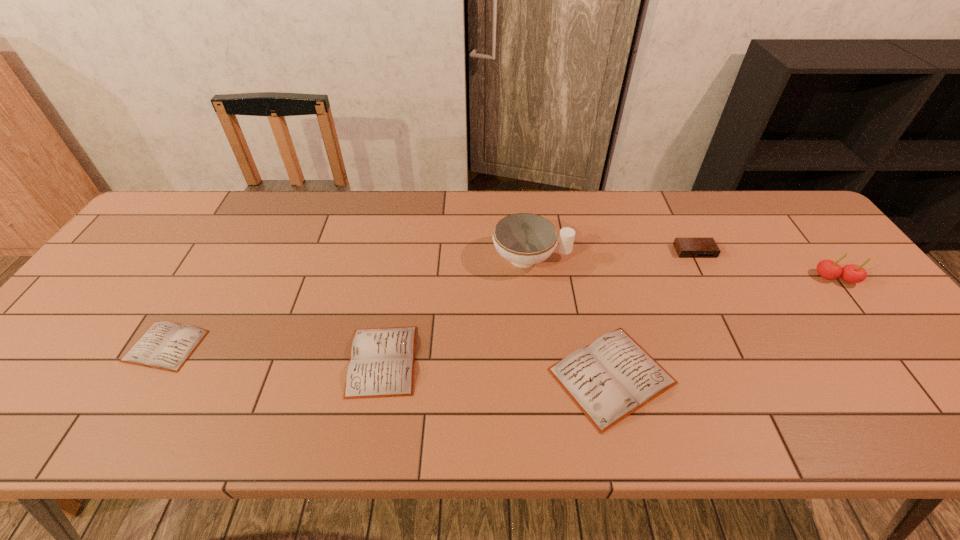
The height and width of the screenshot is (540, 960). I want to click on free space between the tallest diary and the fifth object from left to right, so click(653, 314).

I want to click on unoccupied area between the fifth tallest object and the rightmost object, so click(x=609, y=320).

Identify which object is located as the fifth nearest to the alarm clock. Please provide its 2D coordinates. Your answer should be formatted as a tuple, i.e. [(x, y)], where the tuple contains the x and y coordinates of a point satisfying the conditions above.

[(165, 345)]

Where is `object that is the closest to the leftmost diary`? This screenshot has height=540, width=960. object that is the closest to the leftmost diary is located at coordinates (382, 360).

Identify the location of the closest diary relative to the second diary from left to right. Image resolution: width=960 pixels, height=540 pixels. (609, 379).

Choose which diary is the nearest neighbor to the leftmost object. Please provide its 2D coordinates. Your answer should be formatted as a tuple, i.e. [(x, y)], where the tuple contains the x and y coordinates of a point satisfying the conditions above.

[(382, 360)]

Where is `free region that satisfies the following two spatial constraints: 1. on the back side of the tallest diary; 2. on the side with the handle of the chinaware`? Image resolution: width=960 pixels, height=540 pixels. free region that satisfies the following two spatial constraints: 1. on the back side of the tallest diary; 2. on the side with the handle of the chinaware is located at coordinates (584, 258).

What are the coordinates of `vacant position in the image that satisfies the following two spatial constraints: 1. on the side with the handle of the rightmost diary; 2. on the right side of the chinaware` in the screenshot? It's located at (545, 376).

Locate an element on the screen. The image size is (960, 540). free space in the image that satisfies the following two spatial constraints: 1. on the front face of the alarm clock; 2. on the side with the handle of the chinaware is located at coordinates (698, 258).